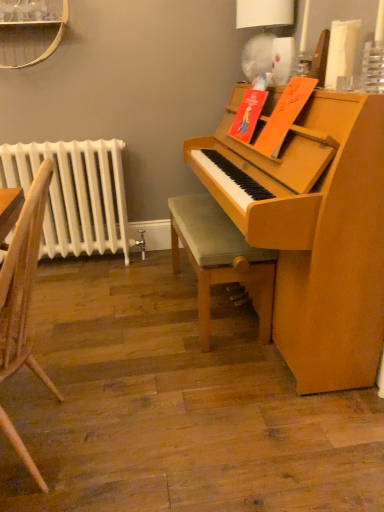
Question: Relative to white paper lampshade at upper right, is white painted metal radiator at left in front or behind?

Choices:
 (A) behind
 (B) front

Answer: (A)

Question: In terms of size, does white painted metal radiator at left appear bigger or smaller than white paper lampshade at upper right?

Choices:
 (A) small
 (B) big

Answer: (B)

Question: Which object is positioned farthest from the wooden chair at left?

Choices:
 (A) white paper lampshade at upper right
 (B) green fabric stool at center
 (C) white painted metal radiator at left

Answer: (A)

Question: Based on their relative distances, which object is nearer to the green fabric stool at center?

Choices:
 (A) white paper lampshade at upper right
 (B) white painted metal radiator at left
 (C) wooden chair at left

Answer: (C)